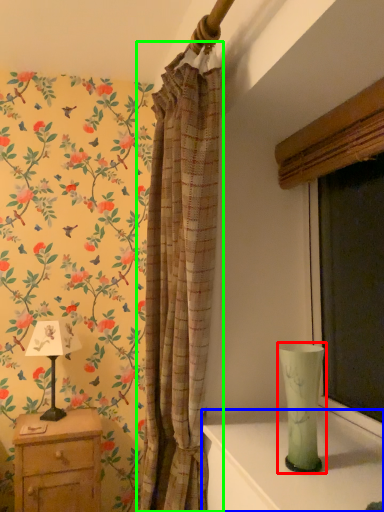
Question: Which object is positioned farthest from glass vase (highlighted by a red box)? Select from table (highlighted by a blue box) and curtain (highlighted by a green box).

Choices:
 (A) table
 (B) curtain

Answer: (B)